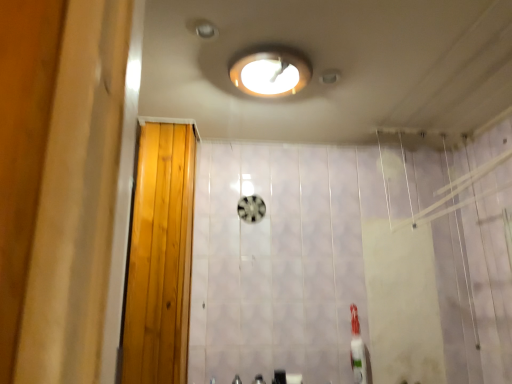
Question: Is metallic silver faucet at lower center, the 2th faucet when ordered from right to left, positioned beyond the bounds of white matte toilet paper at lower center?

Choices:
 (A) yes
 (B) no

Answer: (A)

Question: Can you confirm if metallic silver faucet at lower center, the 1th faucet positioned from the left, is taller than white matte toilet paper at lower center?

Choices:
 (A) no
 (B) yes

Answer: (B)

Question: Does metallic silver faucet at lower center, the 2th faucet when ordered from right to left, appear on the left side of white matte toilet paper at lower center?

Choices:
 (A) no
 (B) yes

Answer: (B)

Question: Is metallic silver faucet at lower center, the 1th faucet positioned from the left, looking in the opposite direction of white matte toilet paper at lower center?

Choices:
 (A) yes
 (B) no

Answer: (B)

Question: Is metallic silver faucet at lower center, the 2th faucet when ordered from right to left, closer to the viewer compared to white matte toilet paper at lower center?

Choices:
 (A) no
 (B) yes

Answer: (B)

Question: From the image's perspective, is metallic silver faucet at lower center, the 2th faucet when ordered from right to left, beneath white matte toilet paper at lower center?

Choices:
 (A) no
 (B) yes

Answer: (A)

Question: Are wooden door at left and white glossy toothbrush at lower right beside each other?

Choices:
 (A) no
 (B) yes

Answer: (A)

Question: From the image's perspective, would you say wooden door at left is positioned over white glossy toothbrush at lower right?

Choices:
 (A) yes
 (B) no

Answer: (A)

Question: Considering the relative positions of wooden door at left and white glossy toothbrush at lower right in the image provided, is wooden door at left to the left of white glossy toothbrush at lower right from the viewer's perspective?

Choices:
 (A) no
 (B) yes

Answer: (B)

Question: From a real-world perspective, is wooden door at left positioned under white glossy toothbrush at lower right based on gravity?

Choices:
 (A) yes
 (B) no

Answer: (B)

Question: From the image's perspective, would you say wooden door at left is shown under white glossy toothbrush at lower right?

Choices:
 (A) no
 (B) yes

Answer: (A)

Question: Would you say wooden door at left is outside white glossy toothbrush at lower right?

Choices:
 (A) no
 (B) yes

Answer: (B)

Question: From a real-world perspective, is white glossy toothbrush at lower right positioned over metallic silver faucet at lower center, the 2th faucet when ordered from right to left, based on gravity?

Choices:
 (A) no
 (B) yes

Answer: (B)